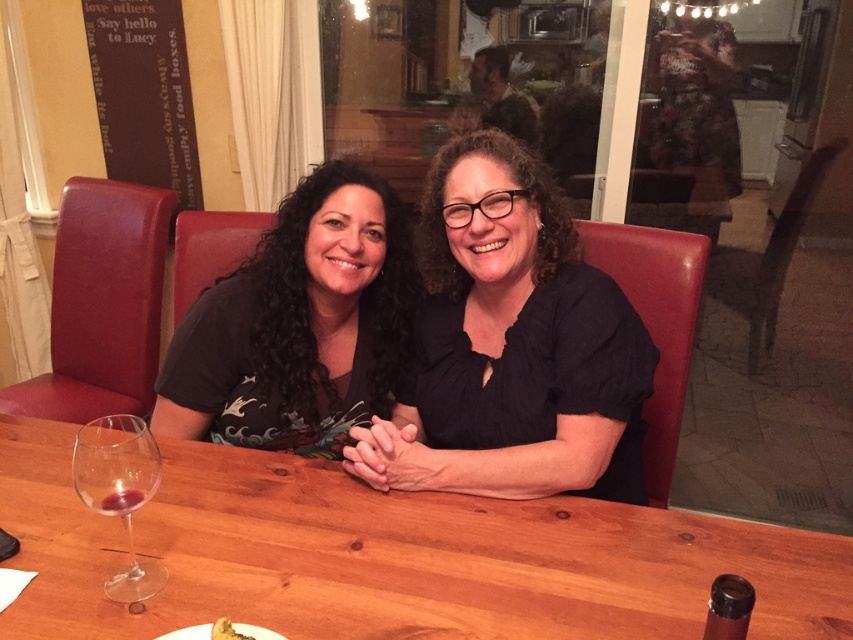
From the picture: You are a waiter at a restaurant and need to clear the table. You see the clear glass wine at lower left and the yellow crumbly bread at lower center. Which item should you pick up first to avoid spilling the wine?

You should pick up the yellow crumbly bread at lower center first because the clear glass wine at lower left is positioned over it. Removing the bread first would prevent disturbing the glass and causing a spill.

You are arranging a dinner party and need to place a centerpiece on the wooden table at center. Since the clear glass wine at lower left is already on the table, where should you position the centerpiece to ensure it doesn t interfere with the wine glass?

The wooden table at center is to the right of the clear glass wine at lower left. To avoid interference, place the centerpiece on the opposite side of the wooden table at center away from the clear glass wine at lower left.

Looking at this image, you are standing in a room with a wooden table at center. If you want to place a new decorative item on the table, where exactly should you place it to align with the existing items?

The wooden table at center is located at point (x=389, y=556), so you should place the new decorative item near that coordinate to align with the existing items.